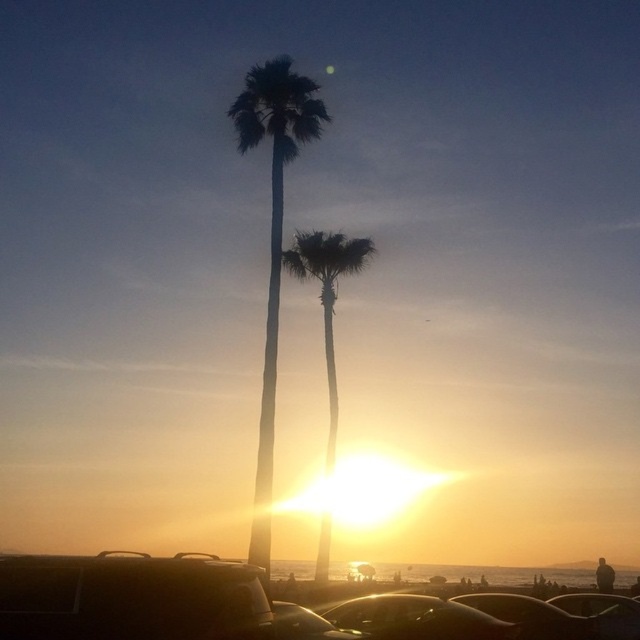
From the picture: You are standing at the point marked as point (531,616) on the beach scene. Looking around, you notice a metallic silver car at lower center. Can you determine if the point you are standing on is located on the metallic silver car at lower center?

Yes, the point (531,616) is on the metallic silver car at lower center according to the description.

You are a photographer standing at the beach during sunset. You see two cars, a metallic silver car at lower center and a shiny metallic car at lower center. Which car is positioned lower in the image?

The metallic silver car at lower center is located below the shiny metallic car at lower center, so it is positioned lower in the image.

You are driving a car and want to park it near the beach. You see the silhouette palm tree at center and the shiny metallic car at lower center. Which object is closer to you as you approach the beach?

The silhouette palm tree at center is closer to you because the shiny metallic car at lower center is positioned behind it.